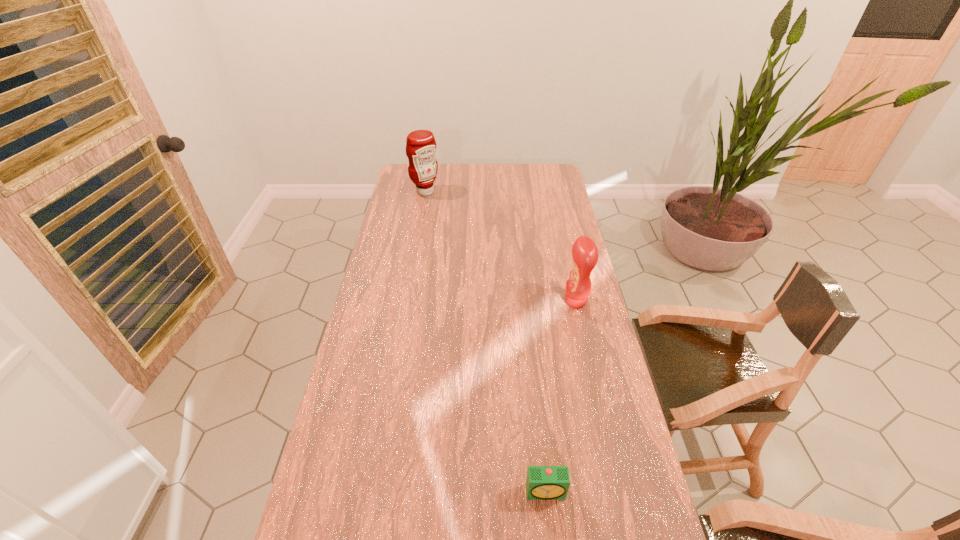
At what (x,y) coordinates should I click in order to perform the action: click on free space located on the front-facing side of the nearest object. Please return your answer as a coordinate pair (x, y). This screenshot has height=540, width=960. Looking at the image, I should click on [x=551, y=533].

At what (x,y) coordinates should I click in order to perform the action: click on object located in the far edge section of the desktop. Please return your answer as a coordinate pair (x, y). This screenshot has width=960, height=540. Looking at the image, I should click on (421, 147).

What are the coordinates of `object positioned at the left edge` in the screenshot? It's located at (421, 147).

The height and width of the screenshot is (540, 960). I want to click on object that is positioned at the right edge, so click(x=584, y=251).

I want to click on object that is positioned at the far left corner, so click(x=421, y=147).

The image size is (960, 540). In the image, there is a desktop. Identify the location of free region at the far edge. (463, 181).

Locate an element on the screen. vacant region at the left edge of the desktop is located at coordinates (309, 536).

Identify the location of vacant space at the right edge. (574, 227).

Locate an element on the screen. vacant space at the far right corner is located at coordinates (542, 167).

Locate an element on the screen. The image size is (960, 540). vacant space that is in between the second object from left to right and the leftmost object is located at coordinates (486, 342).